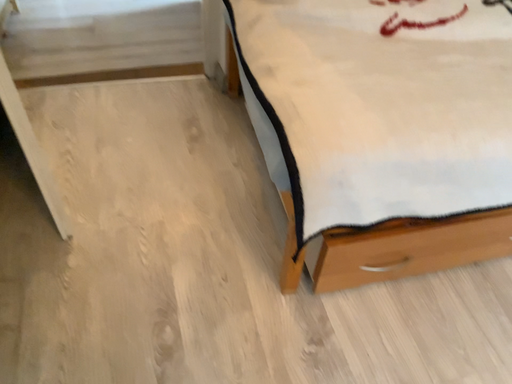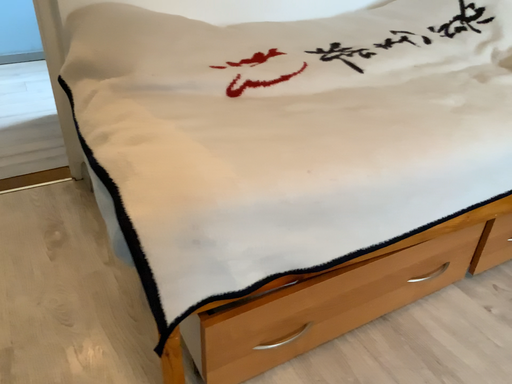
Question: How did the camera likely rotate when shooting the video?

Choices:
 (A) rotated right
 (B) rotated left

Answer: (A)